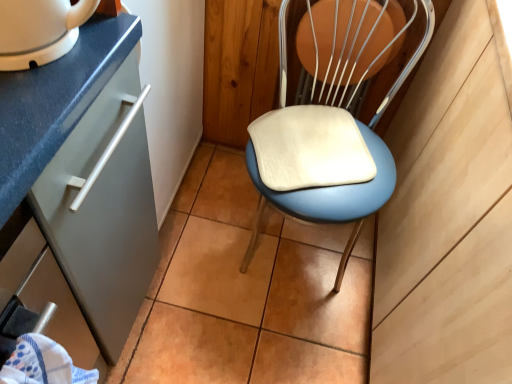
Question: Is white glossy mug at upper left positioned far away from blue fabric towel at lower left?

Choices:
 (A) yes
 (B) no

Answer: (B)

Question: Can you confirm if white glossy mug at upper left is smaller than blue fabric towel at lower left?

Choices:
 (A) no
 (B) yes

Answer: (B)

Question: Is blue fabric towel at lower left at the back of white glossy mug at upper left?

Choices:
 (A) yes
 (B) no

Answer: (B)

Question: Could you tell me if white glossy mug at upper left is turned towards blue fabric towel at lower left?

Choices:
 (A) yes
 (B) no

Answer: (B)

Question: Is white glossy mug at upper left positioned beyond the bounds of blue fabric towel at lower left?

Choices:
 (A) no
 (B) yes

Answer: (B)

Question: Looking at the image, does white glossy mug at upper left seem bigger or smaller compared to blue fabric towel at lower left?

Choices:
 (A) big
 (B) small

Answer: (B)

Question: From their relative heights in the image, would you say white glossy mug at upper left is taller or shorter than blue fabric towel at lower left?

Choices:
 (A) short
 (B) tall

Answer: (A)

Question: Relative to blue fabric towel at lower left, is white glossy mug at upper left in front or behind?

Choices:
 (A) front
 (B) behind

Answer: (B)

Question: Does point (27, 13) appear closer or farther from the camera than point (23, 374)?

Choices:
 (A) farther
 (B) closer

Answer: (B)

Question: Do you think blue fabric towel at lower left is within blue padded chair at center, or outside of it?

Choices:
 (A) inside
 (B) outside

Answer: (B)

Question: Visually, is blue fabric towel at lower left positioned to the left or to the right of blue padded chair at center?

Choices:
 (A) left
 (B) right

Answer: (A)

Question: From a real-world perspective, is blue fabric towel at lower left physically located above or below blue padded chair at center?

Choices:
 (A) below
 (B) above

Answer: (B)

Question: Is point (59, 360) closer or farther from the camera than point (335, 188)?

Choices:
 (A) closer
 (B) farther

Answer: (A)

Question: Is blue fabric towel at lower left inside or outside of white glossy mug at upper left?

Choices:
 (A) inside
 (B) outside

Answer: (B)

Question: Considering the positions of blue fabric towel at lower left and white glossy mug at upper left in the image, is blue fabric towel at lower left wider or thinner than white glossy mug at upper left?

Choices:
 (A) thin
 (B) wide

Answer: (A)